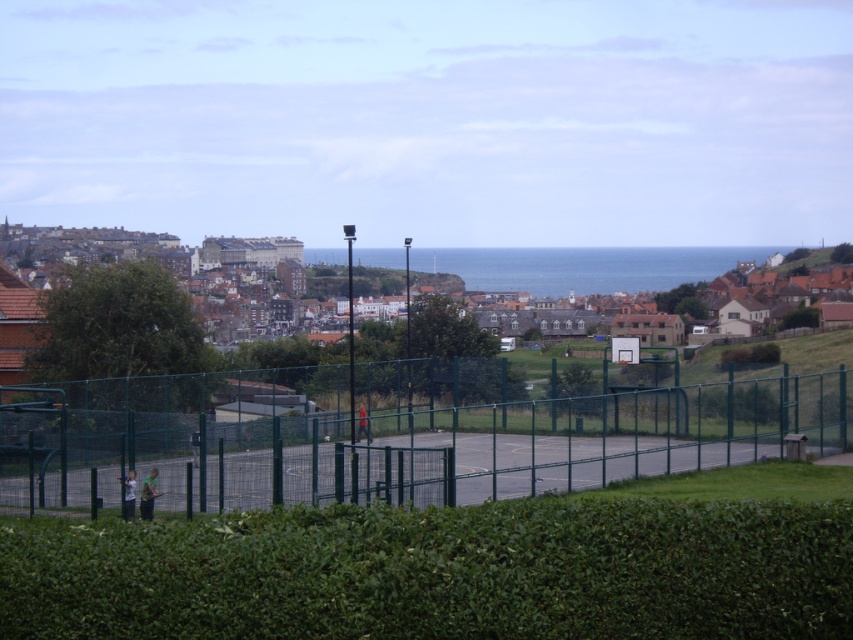
Between point (711, 264) and point (144, 513), which one is positioned behind?

Point (711, 264)

Does brown brick houses at upper left have a larger size compared to green fabric shirt at lower left?

Indeed, brown brick houses at upper left has a larger size compared to green fabric shirt at lower left.

Between point (339, 259) and point (149, 500), which one is positioned behind?

The point (339, 259) is behind.

At what (x,y) coordinates should I click in order to perform the action: click on brown brick houses at upper left. Please return your answer as a coordinate pair (x, y). Looking at the image, I should click on (x=581, y=266).

Which is in front, point (579, 426) or point (122, 515)?

Point (122, 515)

Can you confirm if green metal fence at center is thinner than light blue fabric shirt at lower left?

In fact, green metal fence at center might be wider than light blue fabric shirt at lower left.

Is point (733, 460) farther from camera compared to point (129, 492)?

That is True.

Locate an element on the screen. The height and width of the screenshot is (640, 853). green metal fence at center is located at coordinates (413, 445).

Is brown brick houses at upper left positioned in front of light blue fabric shirt at lower left?

That is False.

In the scene shown: Does brown brick houses at upper left have a larger size compared to light blue fabric shirt at lower left?

Yes, brown brick houses at upper left is bigger than light blue fabric shirt at lower left.

Who is more forward, (668, 256) or (132, 474)?

Point (132, 474)

This screenshot has height=640, width=853. In order to click on brown brick houses at upper left in this screenshot , I will do `click(581, 266)`.